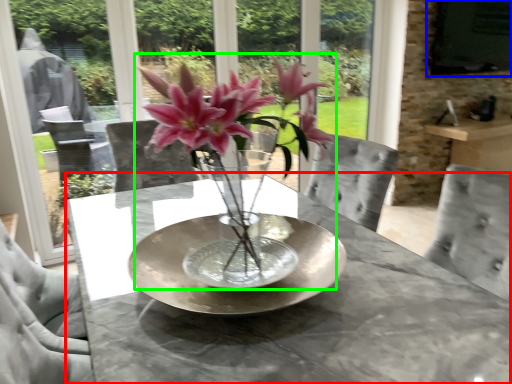
Question: Which object is positioned farthest from table (highlighted by a red box)? Select from window screen (highlighted by a blue box) and houseplant (highlighted by a green box).

Choices:
 (A) window screen
 (B) houseplant

Answer: (A)